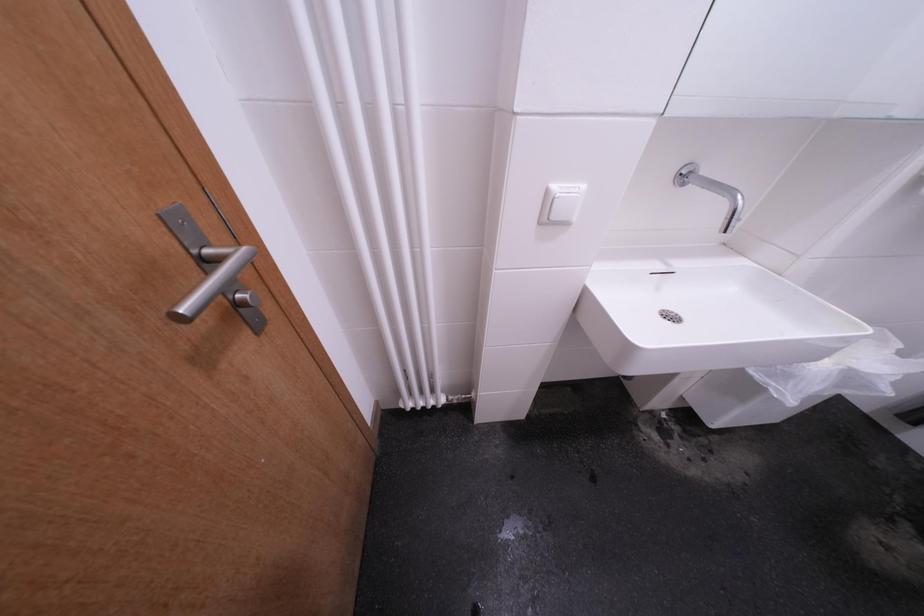
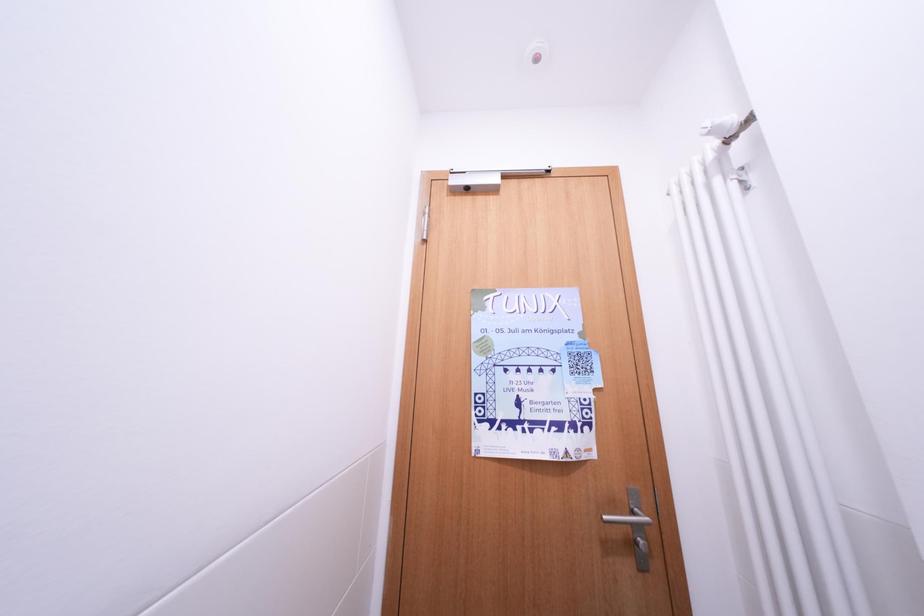
Question: The camera is either moving clockwise (left) or counter-clockwise (right) around the object. The first image is from the beginning of the video and the second image is from the end. Is the camera moving left or right when shooting the video?

Choices:
 (A) Left
 (B) Right

Answer: (B)